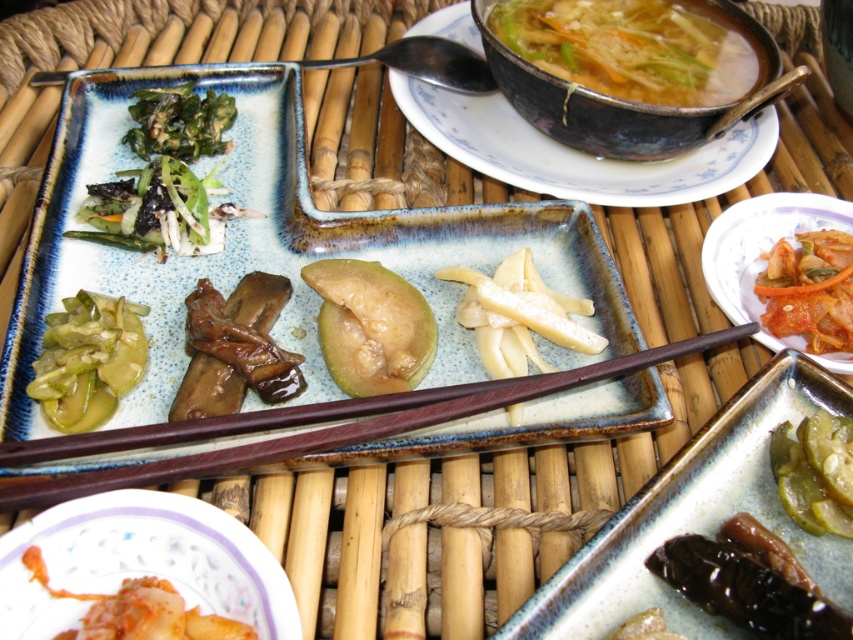
Does point (160, 256) come in front of point (138, 349)?

No, it is not.

Where is `green leafy vegetables at upper left`? Image resolution: width=853 pixels, height=640 pixels. green leafy vegetables at upper left is located at coordinates (165, 177).

Locate an element on the screen. green leafy vegetables at upper left is located at coordinates (165, 177).

In the scene shown: Who is lower down, translucent broth with vegetables at upper center or brown glossy mushrooms at center?

brown glossy mushrooms at center

How far apart are translucent broth with vegetables at upper center and brown glossy mushrooms at center?

The distance of translucent broth with vegetables at upper center from brown glossy mushrooms at center is 21.69 inches.

Which is behind, point (558, 44) or point (247, 273)?

Point (558, 44)

What are the coordinates of `translucent broth with vegetables at upper center` in the screenshot? It's located at (634, 48).

Does green leafy vegetables at upper left appear on the right side of white glossy bamboo shoots at center?

Incorrect, green leafy vegetables at upper left is not on the right side of white glossy bamboo shoots at center.

Who is positioned more to the right, green leafy vegetables at upper left or white glossy bamboo shoots at center?

Positioned to the right is white glossy bamboo shoots at center.

Identify the location of green leafy vegetables at upper left. (165, 177).